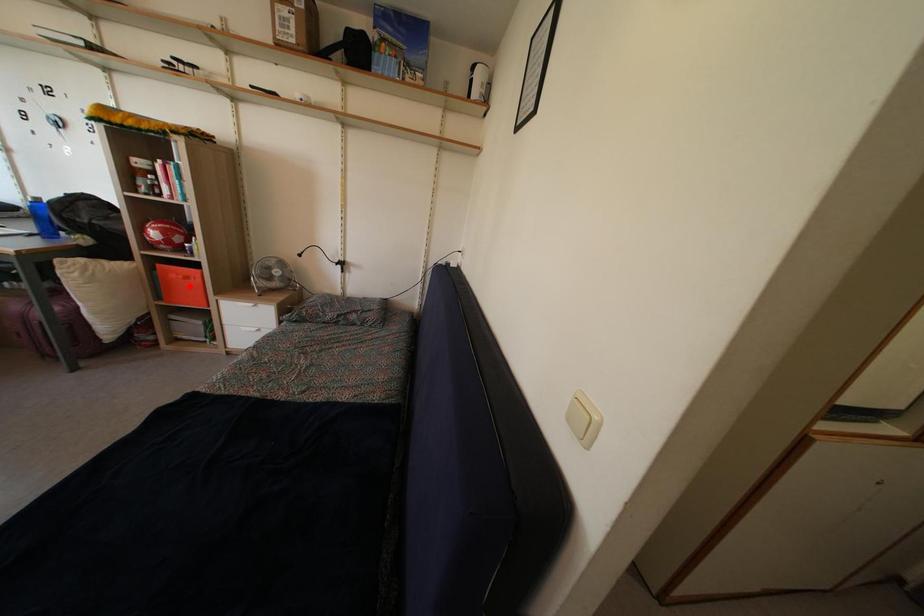
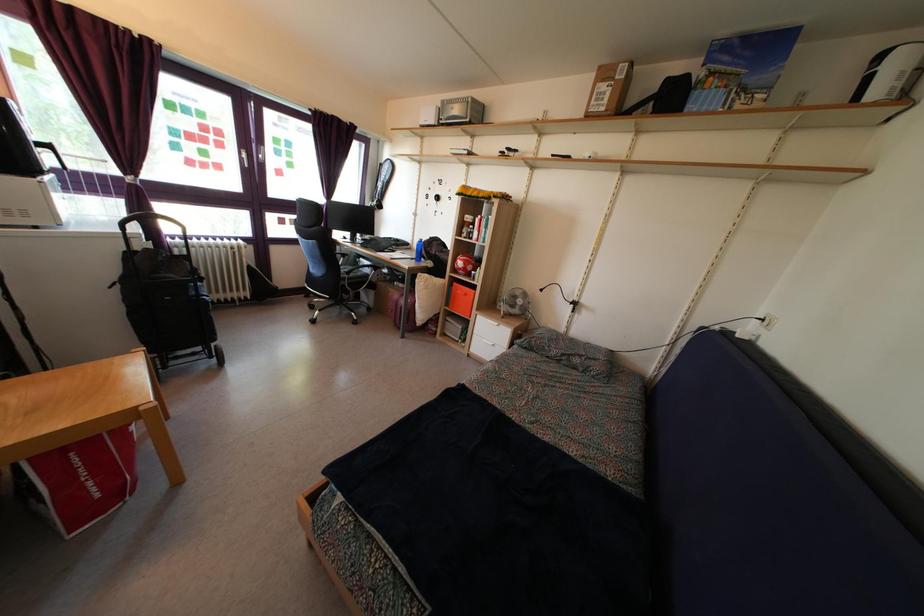
The point at the highlighted location is marked in the first image. Where is the corresponding point in the second image?

(468, 302)